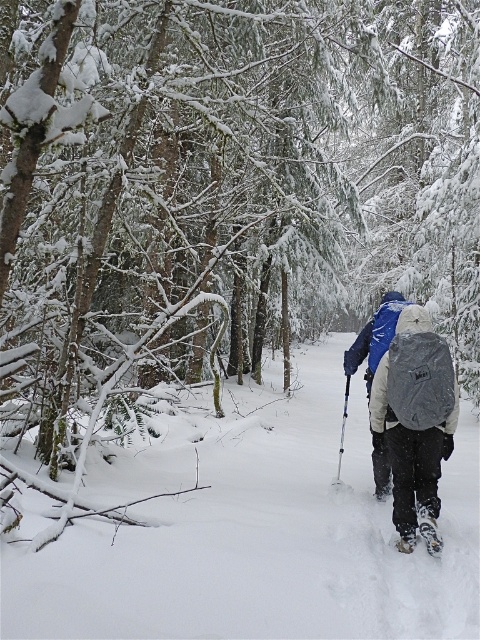
Based on the photo, you are a photographer planning to take a photo of the blue fabric jacket at center and the white rubber snowshoe at lower center. Which object should you focus on first if you want to capture both in sharp focus, considering their relative heights?

You should focus on the blue fabric jacket at center first because it is taller than the white rubber snowshoe at lower center, so focusing on the taller object will help ensure both are in focus.

You are standing on the path in the winter forest scene. There are two points marked on the path. Which point is closer to you? The points are labeled as point (391, 301) and point (408, 538).

Point (391, 301) is closer to you because it is further to the viewer than point (408, 538).

You are planning to take a photo of the gray fabric backpack at center while standing at the starting point of the path. Based on its position, where should you aim your camera to capture it?

You should aim your camera towards the center of the image, specifically at the coordinates point (416, 419), to capture the gray fabric backpack at center.